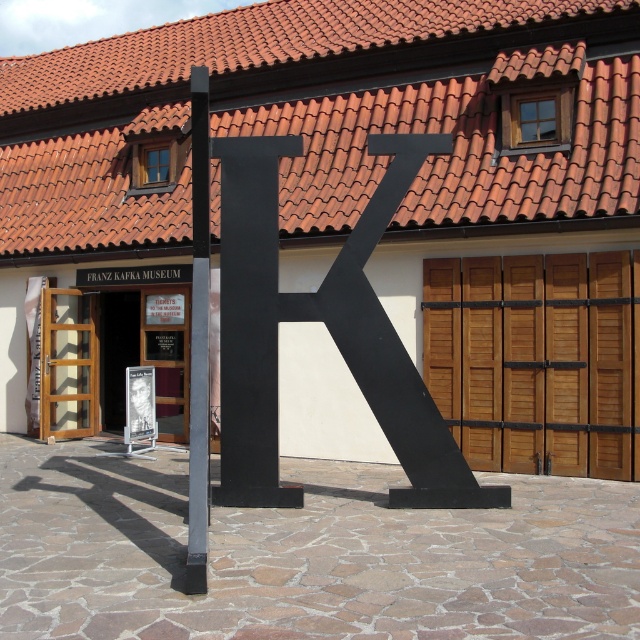
Looking at this image, is red clay tiles at upper center above black matte letter k at center?

Yes, red clay tiles at upper center is above black matte letter k at center.

Does red clay tiles at upper center have a lesser height compared to black matte letter k at center?

No, red clay tiles at upper center is not shorter than black matte letter k at center.

Does point (186, 83) come closer to viewer compared to point (413, 134)?

No, (186, 83) is further to viewer.

This screenshot has width=640, height=640. I want to click on red clay tiles at upper center, so [323, 116].

Between point (268, 476) and point (202, 147), which one is positioned in front?

Positioned in front is point (202, 147).

Can you confirm if black matte letter k at center is positioned to the right of metallic gray pole at center?

Indeed, black matte letter k at center is positioned on the right side of metallic gray pole at center.

You are a GUI agent. You are given a task and a screenshot of the screen. Output one action in this format:
    pyautogui.click(x=<x>, y=<y>)
    Task: Click on the black matte letter k at center
    This screenshot has height=640, width=640.
    Given the screenshot: What is the action you would take?
    pyautogui.click(x=326, y=330)

Which is more to the right, red clay tiles at upper center or metallic gray pole at center?

metallic gray pole at center

Is red clay tiles at upper center smaller than metallic gray pole at center?

No, red clay tiles at upper center is not smaller than metallic gray pole at center.

Measure the distance between point (401,54) and camera.

13.33 meters

Find the location of `red clay tiles at upper center`. red clay tiles at upper center is located at coordinates (323, 116).